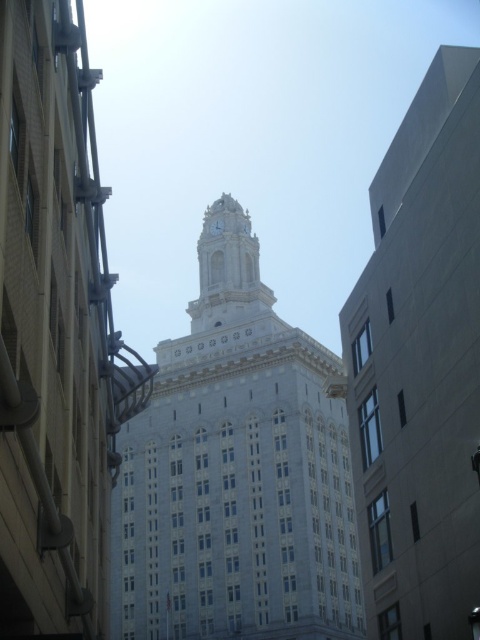
Between point (247, 244) and point (219, 230), which one is positioned behind?

Positioned behind is point (219, 230).

Does white stone clock tower at center have a greater width compared to white marble clock at center?

Yes, white stone clock tower at center is wider than white marble clock at center.

Find the location of `white stone clock tower at center`. white stone clock tower at center is located at coordinates (236, 472).